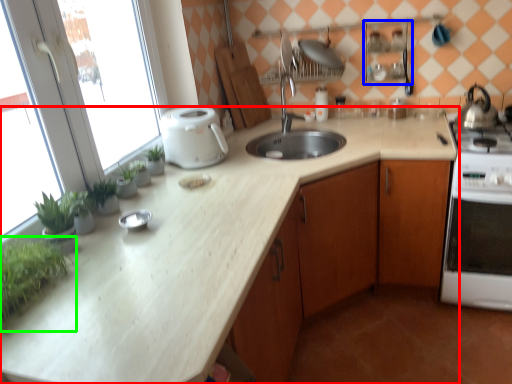
Question: Estimate the real-world distances between objects in this image. Which object is closer to countertop (highlighted by a red box), shelf (highlighted by a blue box) or plant (highlighted by a green box)?

Choices:
 (A) shelf
 (B) plant

Answer: (B)